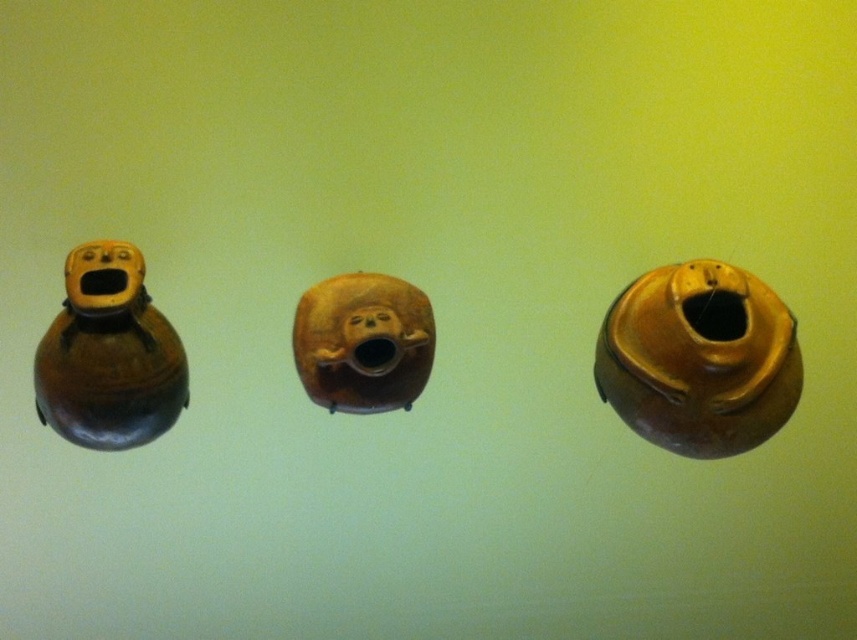
Is matte brown vase at center below brown matte monkey head at center?

Yes.

Who is more forward, [788,312] or [325,280]?

Point [788,312]

This screenshot has width=857, height=640. In order to click on matte brown vase at center in this screenshot , I will do `click(699, 358)`.

Based on the photo, who is more forward, (159, 417) or (405, 332)?

Point (159, 417)

Does point (163, 353) come in front of point (379, 324)?

Yes, point (163, 353) is closer to viewer.

Find the location of a particular element. This screenshot has width=857, height=640. matte brown vase at left is located at coordinates (108, 355).

Which is behind, point (668, 397) or point (90, 368)?

Point (668, 397)

Is matte brown vase at center closer to camera compared to matte brown vase at left?

That is False.

Does point (668, 312) come farther from viewer compared to point (108, 275)?

That is True.

This screenshot has width=857, height=640. Identify the location of matte brown vase at center. (699, 358).